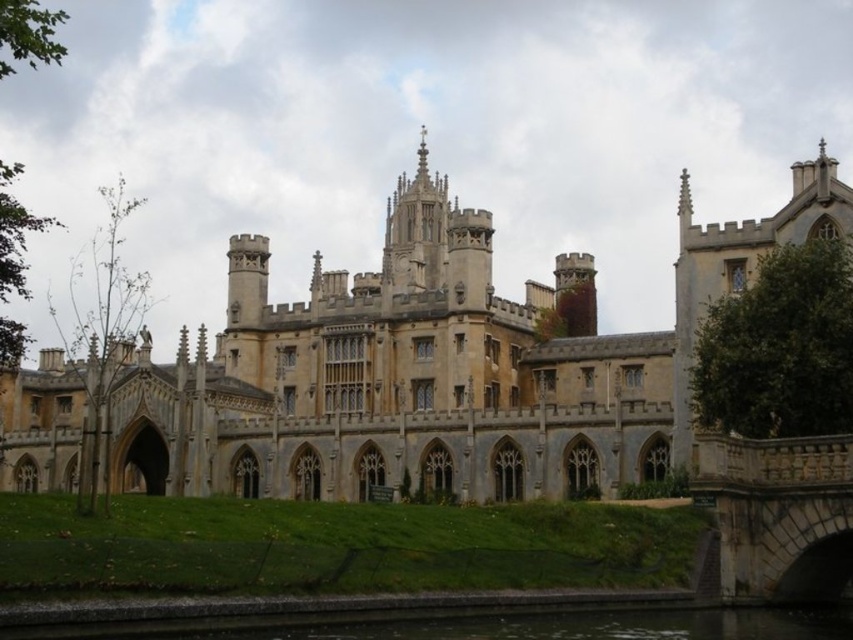
Does beige stone castle at center appear on the left side of green concrete river at lower center?

Correct, you'll find beige stone castle at center to the left of green concrete river at lower center.

Can you confirm if beige stone castle at center is smaller than green concrete river at lower center?

No, beige stone castle at center is not smaller than green concrete river at lower center.

Which is behind, point (323, 394) or point (788, 609)?

The point (323, 394) is behind.

Where is `beige stone castle at center`? The height and width of the screenshot is (640, 853). beige stone castle at center is located at coordinates (434, 365).

Does point (740, 560) lie behind point (543, 611)?

That is True.

Looking at this image, between stone textured bridge at lower right and green concrete river at lower center, which one has less height?

green concrete river at lower center

Which is behind, point (838, 589) or point (164, 637)?

Point (838, 589)

Identify the location of stone textured bridge at lower right. This screenshot has width=853, height=640. (779, 513).

Can you confirm if beige stone castle at center is shorter than stone textured bridge at lower right?

No, beige stone castle at center is not shorter than stone textured bridge at lower right.

The width and height of the screenshot is (853, 640). I want to click on beige stone castle at center, so click(434, 365).

Find the location of a particular element. Image resolution: width=853 pixels, height=640 pixels. beige stone castle at center is located at coordinates (434, 365).